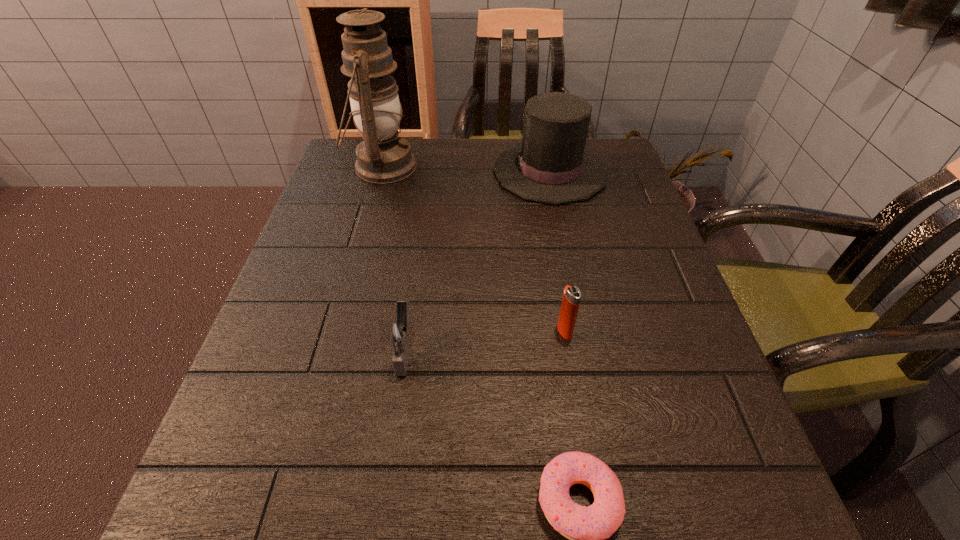
You are a GUI agent. You are given a task and a screenshot of the screen. Output one action in this format:
    pyautogui.click(x=<x>, y=<y>)
    Task: Click on the vacant space situated on the left of the right igniter
    
    Given the screenshot: What is the action you would take?
    pyautogui.click(x=450, y=331)

Locate an element on the screen. oil lamp located in the far edge section of the desktop is located at coordinates (383, 157).

At what (x,y) coordinates should I click in order to perform the action: click on dress hat positioned at the far edge. Please return your answer as a coordinate pair (x, y). The image size is (960, 540). Looking at the image, I should click on (551, 165).

Identify the location of object at the left edge. This screenshot has width=960, height=540. (383, 157).

Where is `object positioned at the right edge`? The image size is (960, 540). object positioned at the right edge is located at coordinates (551, 165).

This screenshot has height=540, width=960. Identify the location of object located at the far left corner. (383, 157).

Identify the location of object at the far right corner. The height and width of the screenshot is (540, 960). (551, 165).

In the image, there is a desktop. Where is `vacant space at the far edge`? This screenshot has width=960, height=540. vacant space at the far edge is located at coordinates (470, 139).

What are the coordinates of `vacant region at the near edge` in the screenshot? It's located at (356, 536).

Identify the location of free space at the left edge. coord(348,231).